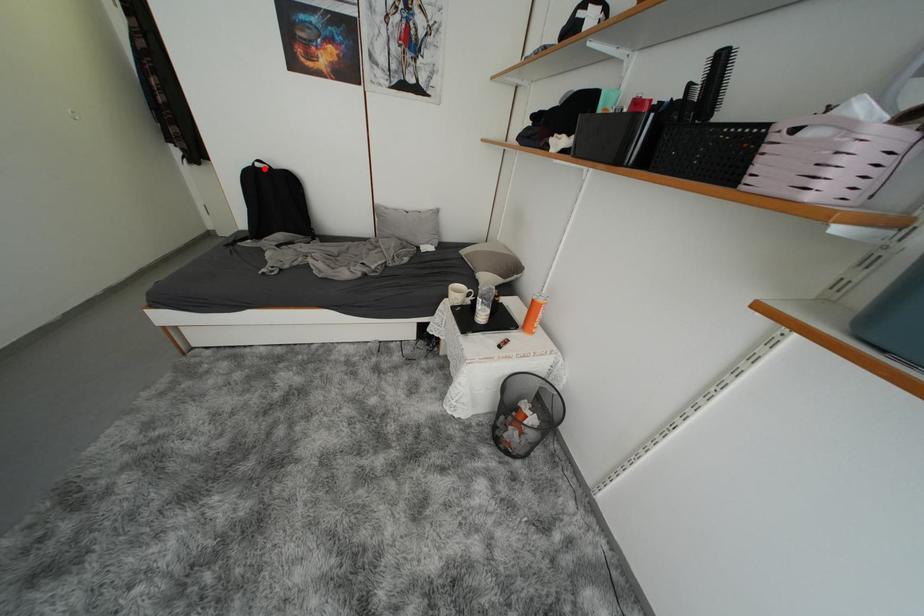
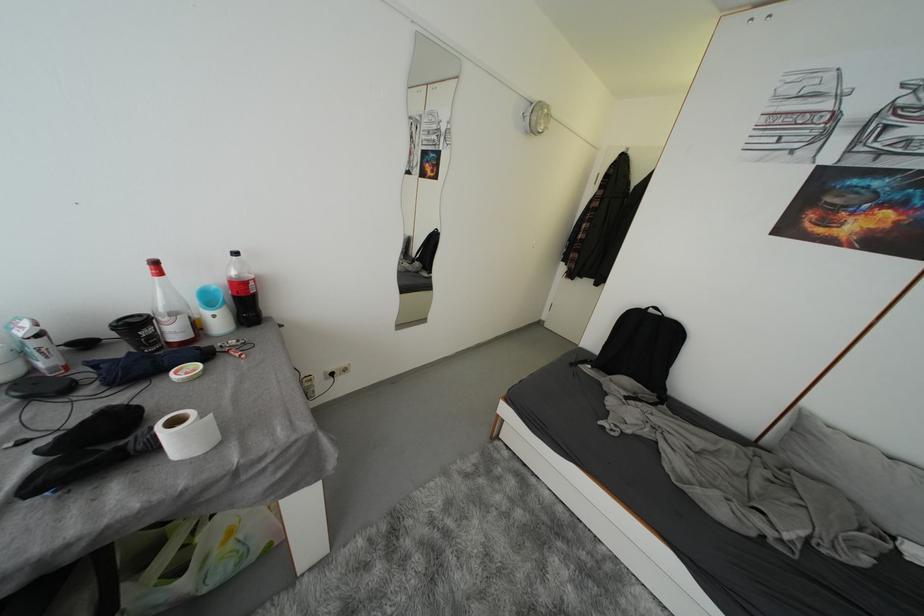
Locate, in the second image, the point that corresponds to the highlighted location in the first image.

(658, 314)